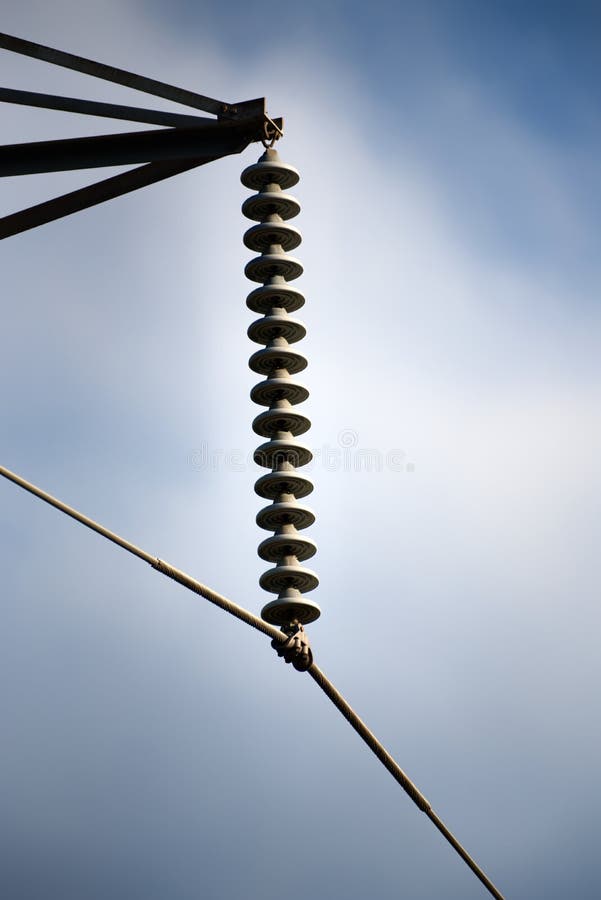
Where is `hanging bar`? The image size is (601, 900). hanging bar is located at coordinates (242, 112).